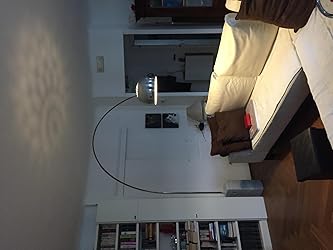
At what (x,y) coordinates should I click in order to perform the action: click on floor. Please return your answer as a coordinate pair (x, y). This screenshot has height=250, width=333. Looking at the image, I should click on (291, 199).